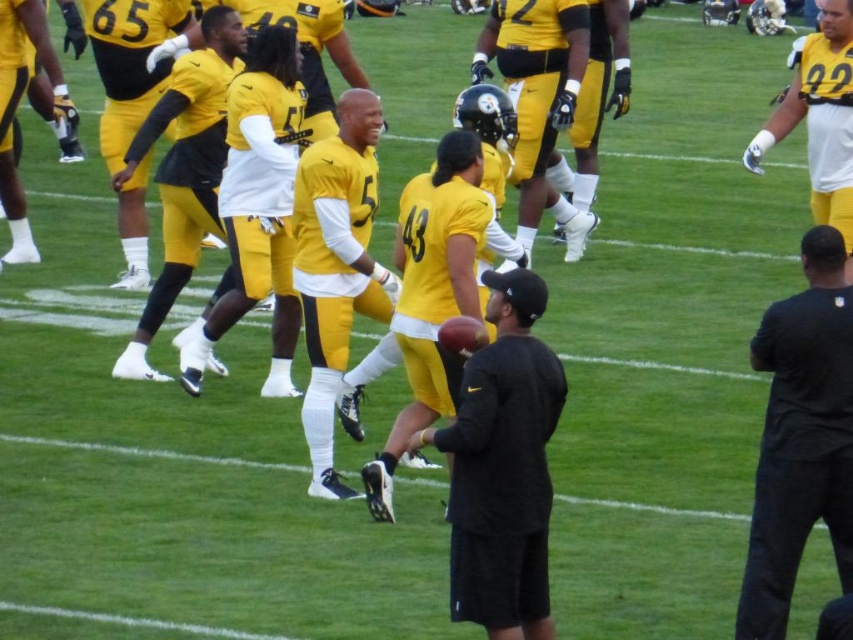
Question: Which point is closer to the camera?

Choices:
 (A) matte yellow uniform at left
 (B) matte yellow uniform at center
 (C) black matte shirt at center
 (D) matte yellow jersey at upper right

Answer: (C)

Question: Is black matte shirt at center behind matte yellow uniform at left?

Choices:
 (A) no
 (B) yes

Answer: (A)

Question: Which point is farther to the camera?

Choices:
 (A) click(x=16, y=93)
 (B) click(x=352, y=152)
 (C) click(x=802, y=422)
 (D) click(x=544, y=289)

Answer: (A)

Question: Does black matte shirt at center have a greater width compared to matte yellow uniform at center?

Choices:
 (A) yes
 (B) no

Answer: (B)

Question: Which of the following is the closest to the observer?

Choices:
 (A) (363, 284)
 (B) (520, 456)
 (C) (15, 253)

Answer: (B)

Question: Is black matte football at center to the right of black matte shirt at center from the viewer's perspective?

Choices:
 (A) no
 (B) yes

Answer: (A)